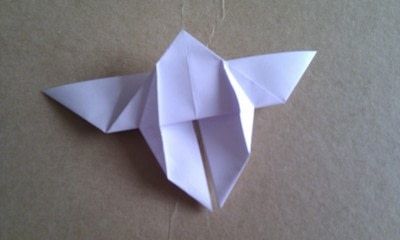
Identify the location of floor. The width and height of the screenshot is (400, 240). (340, 174), (339, 32), (50, 24), (60, 172).